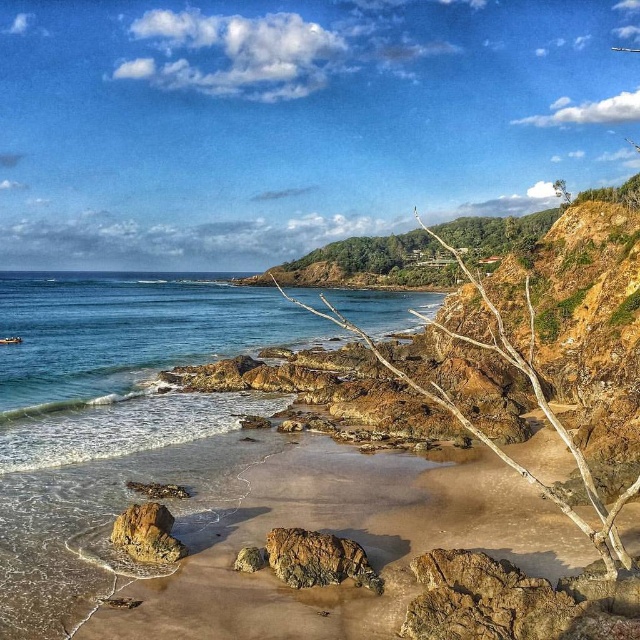
What do you see at coordinates (317, 560) in the screenshot? This screenshot has height=640, width=640. I see `rusty rock at center` at bounding box center [317, 560].

Is rusty rock at center wider than rusty rock at lower left?

Correct, the width of rusty rock at center exceeds that of rusty rock at lower left.

Is point (301, 554) closer to viewer compared to point (154, 500)?

Yes, it is.

Where is `rusty rock at center`? The image size is (640, 640). rusty rock at center is located at coordinates coord(317,560).

Can you confirm if rusty rock at center is thinner than rusty metallic rock at center?

No.

Who is higher up, rusty rock at center or rusty metallic rock at center?

Positioned higher is rusty metallic rock at center.

Image resolution: width=640 pixels, height=640 pixels. I want to click on rusty rock at center, so click(x=317, y=560).

This screenshot has height=640, width=640. I want to click on rusty rock at center, so click(x=317, y=560).

Measure the distance between rusty rock at lower left and rusty metallic rock at center.

rusty rock at lower left is 11.98 feet away from rusty metallic rock at center.

Can you confirm if rusty rock at lower left is positioned to the right of rusty metallic rock at center?

In fact, rusty rock at lower left is to the left of rusty metallic rock at center.

Which is behind, point (157, 561) or point (243, 550)?

Point (157, 561)

This screenshot has height=640, width=640. Find the location of `rusty rock at lower left`. rusty rock at lower left is located at coordinates (147, 532).